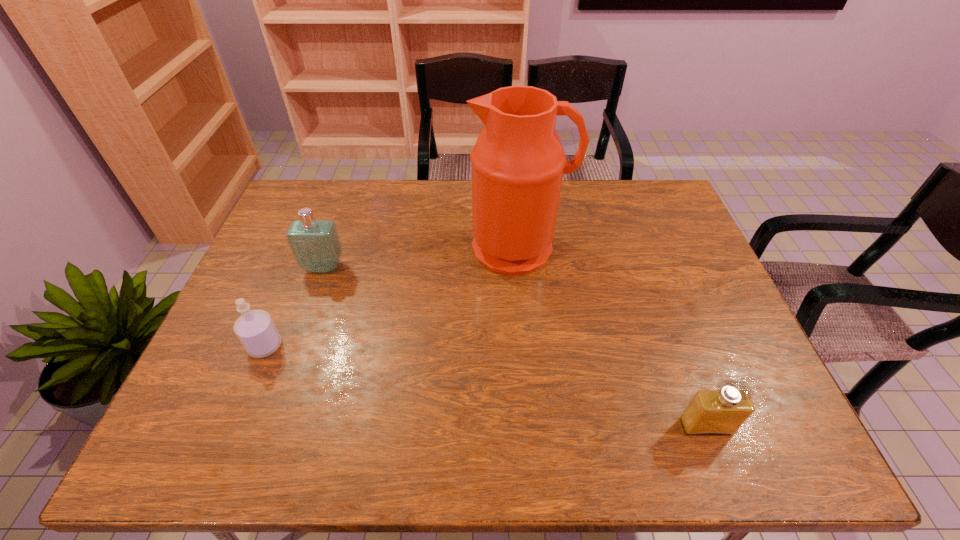
The height and width of the screenshot is (540, 960). What are the coordinates of `perfume that is the closest one to the nearest object` in the screenshot? It's located at (315, 244).

Select which perfume is the second closest to the water jug. Please provide its 2D coordinates. Your answer should be formatted as a tuple, i.e. [(x, y)], where the tuple contains the x and y coordinates of a point satisfying the conditions above.

[(722, 412)]